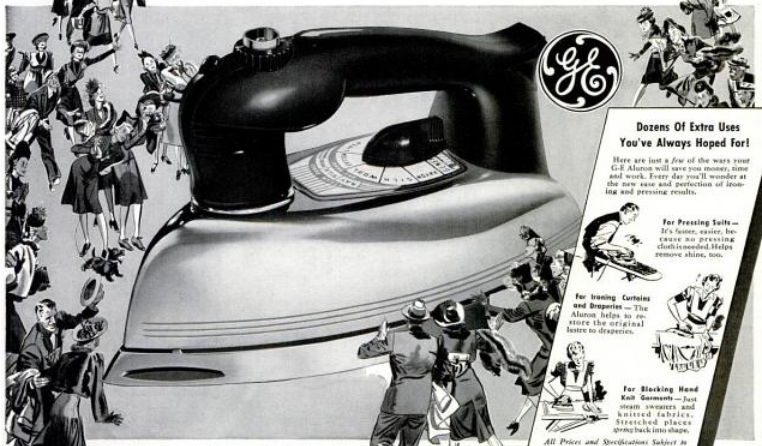
Image resolution: width=762 pixels, height=446 pixels. I want to click on iron, so click(370, 218).